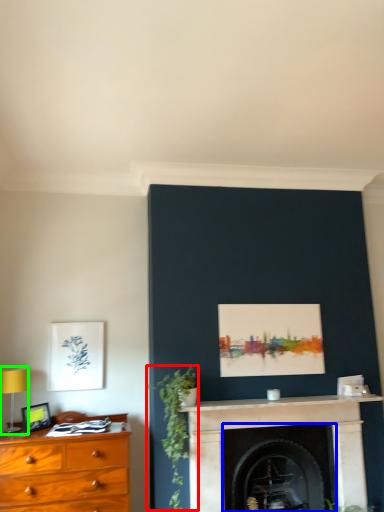
Question: Based on their relative distances, which object is nearer to plant (highlighted by a red box)? Choose from fireplace (highlighted by a blue box) and table lamp (highlighted by a green box).

Choices:
 (A) fireplace
 (B) table lamp

Answer: (A)